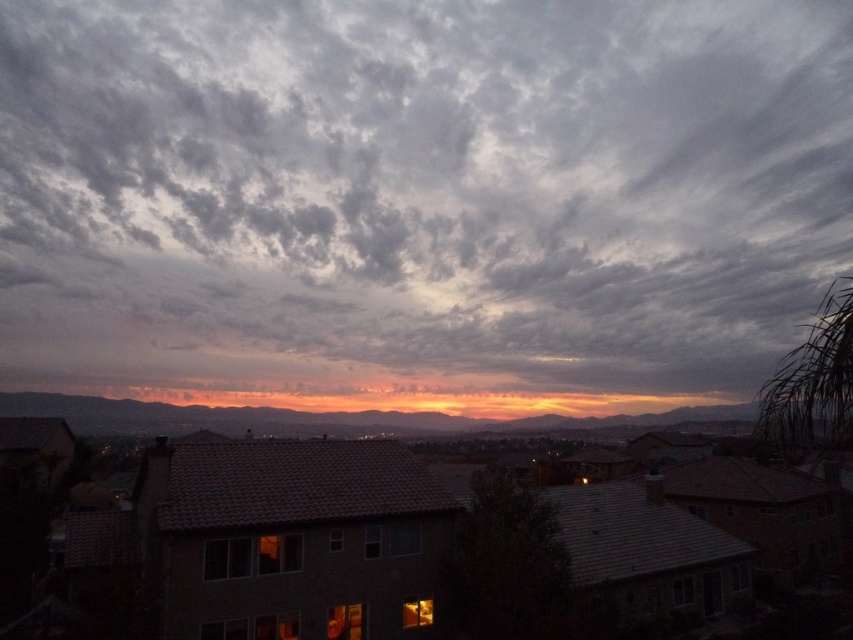
You are standing in the suburban area and want to know the distance between the cloudy sky at upper center and the nearest house. Can you estimate how far apart they are?

The cloudy sky at upper center is 583.06 feet away from the nearest house.

You are an astronomer observing the sunset. You notice the cloudy sky at upper center and the orange sky at center. Which one is closer to you?

The cloudy sky at upper center is closer to you because the orange sky at center is behind it.